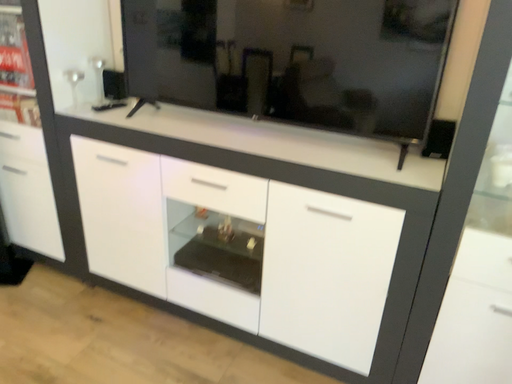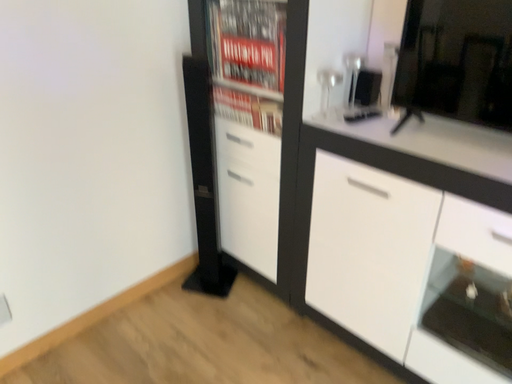
Question: How did the camera likely rotate when shooting the video?

Choices:
 (A) rotated right
 (B) rotated left

Answer: (B)